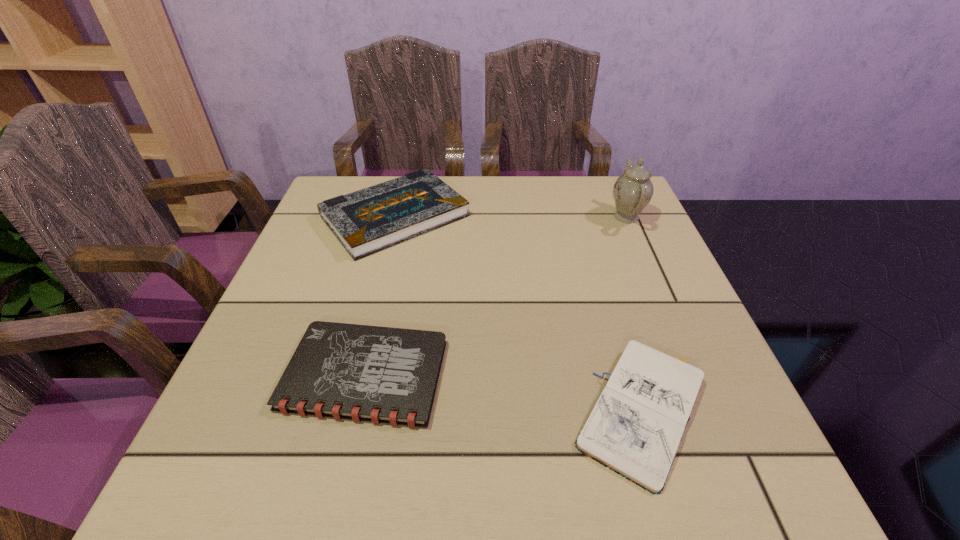
What are the coordinates of `chinaware` in the screenshot? It's located at [x=633, y=190].

At what (x,y) coordinates should I click in order to perform the action: click on the tallest notebook. Please return your answer as a coordinate pair (x, y). Looking at the image, I should click on (369, 220).

The image size is (960, 540). I want to click on the second tallest object, so click(x=369, y=220).

This screenshot has height=540, width=960. Identify the location of the rightmost notebook. (635, 428).

Where is `vacant space situated on the spout of the chinaware`? vacant space situated on the spout of the chinaware is located at coordinates (455, 217).

I want to click on free space located 0.180m on the spout of the chinaware, so click(x=539, y=217).

Locate an element on the screen. The height and width of the screenshot is (540, 960). free space located on the spout of the chinaware is located at coordinates (505, 217).

Where is `blank space located 0.220m on the front of the third shortest object`? blank space located 0.220m on the front of the third shortest object is located at coordinates (365, 334).

In order to click on vacant region located on the back of the rightmost notebook in this screenshot , I will do `click(610, 300)`.

This screenshot has height=540, width=960. Find the location of `chinaware positioned at the far edge`. chinaware positioned at the far edge is located at coordinates pos(633,190).